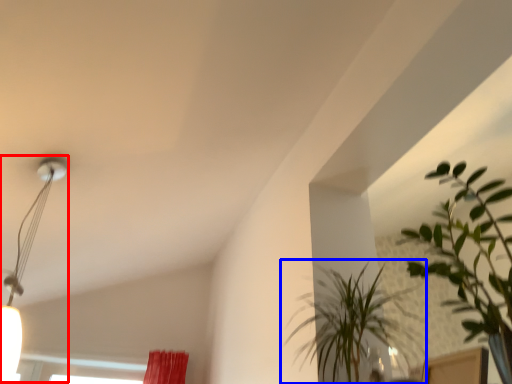
Question: Which object is further to the camera taking this photo, lamp (highlighted by a red box) or houseplant (highlighted by a blue box)?

Choices:
 (A) lamp
 (B) houseplant

Answer: (A)